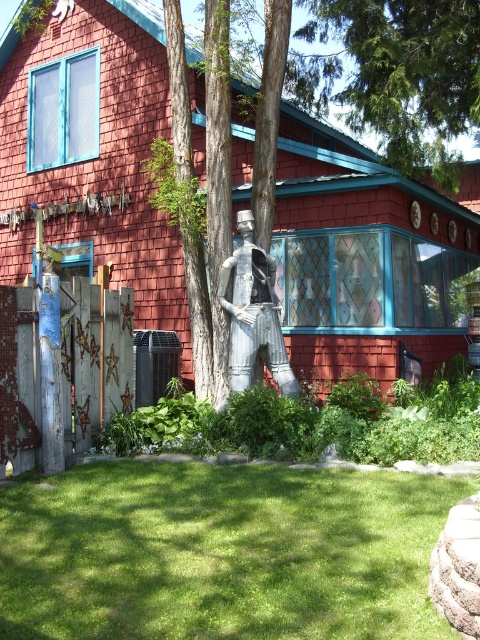
Question: Which object is positioned farthest from the green grass at center?

Choices:
 (A) green leafy tree at upper center
 (B) metallic statue at center

Answer: (A)

Question: Is smooth bark tree at center thinner than green leafy tree at upper center?

Choices:
 (A) no
 (B) yes

Answer: (A)

Question: Which object appears closest to the camera in this image?

Choices:
 (A) smooth bark tree at center
 (B) green leafy tree at upper center
 (C) metallic statue at center
 (D) green grass at center

Answer: (D)

Question: Is smooth bark tree at center positioned before green grass at center?

Choices:
 (A) yes
 (B) no

Answer: (B)

Question: Considering the real-world distances, which object is closest to the green grass at center?

Choices:
 (A) metallic statue at center
 (B) smooth bark tree at center
 (C) green leafy tree at upper center

Answer: (A)

Question: Is green grass at center to the left of green leafy tree at upper center from the viewer's perspective?

Choices:
 (A) yes
 (B) no

Answer: (A)